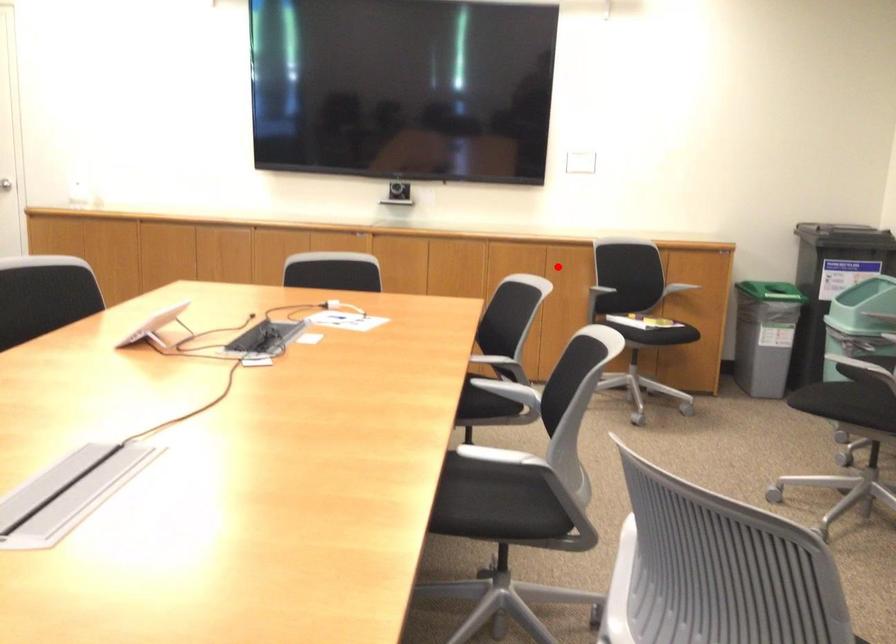
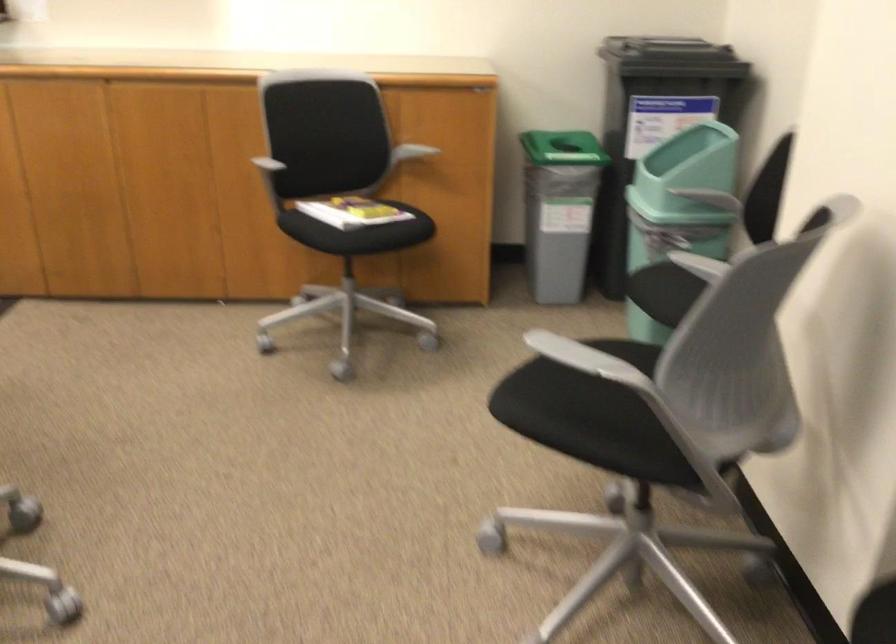
Where in the second image is the point corresponding to the highlighted location from the first image?

(236, 149)